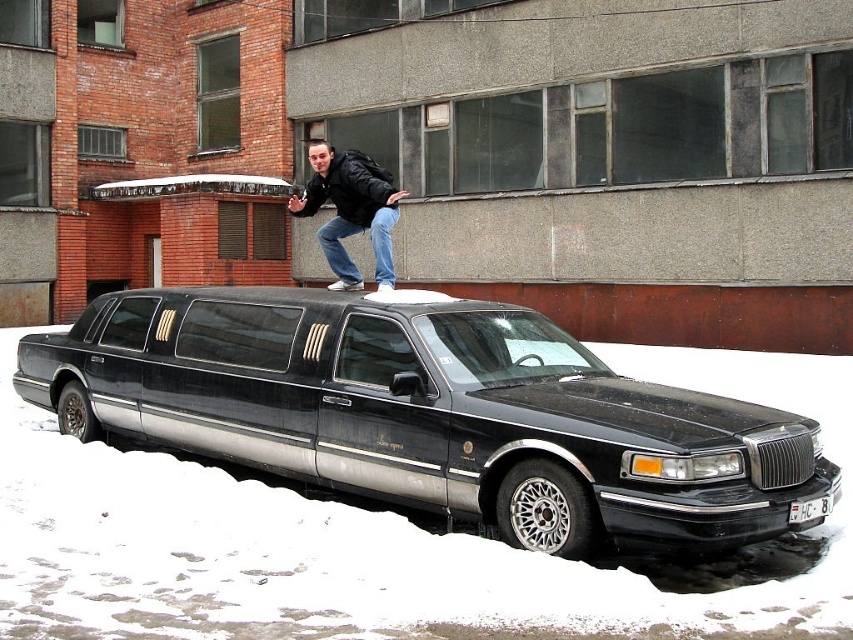
Based on the photo, you are standing at the point marked as point [428,412] in the image. What object are you currently standing on?

The point [428,412] indicates the black metallic limousine at center, so you are standing on the black metallic limousine at center.

You are a photographer trying to capture the license plate of the black metallic limousine at center and the white plastic license plate at center. According to the scene, which object is positioned to the left of the other?

→ The black metallic limousine at center is positioned to the left of the white plastic license plate at center.